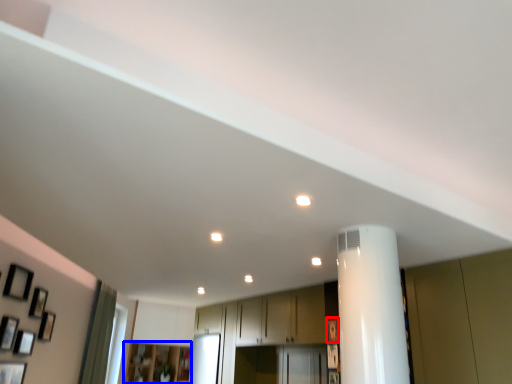
Question: Which object is closer to the camera taking this photo, picture frame (highlighted by a red box) or cabinetry (highlighted by a blue box)?

Choices:
 (A) picture frame
 (B) cabinetry

Answer: (A)